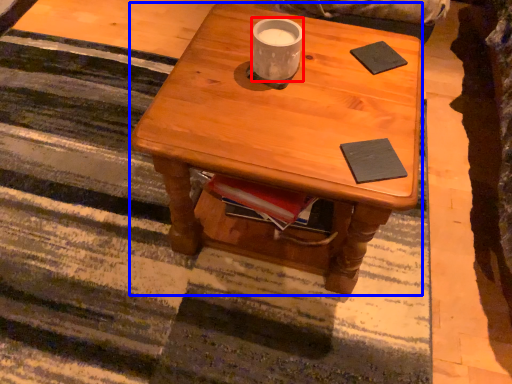
Question: Which of the following is the closest to the observer, coffee cup (highlighted by a red box) or desk (highlighted by a blue box)?

Choices:
 (A) coffee cup
 (B) desk

Answer: (B)